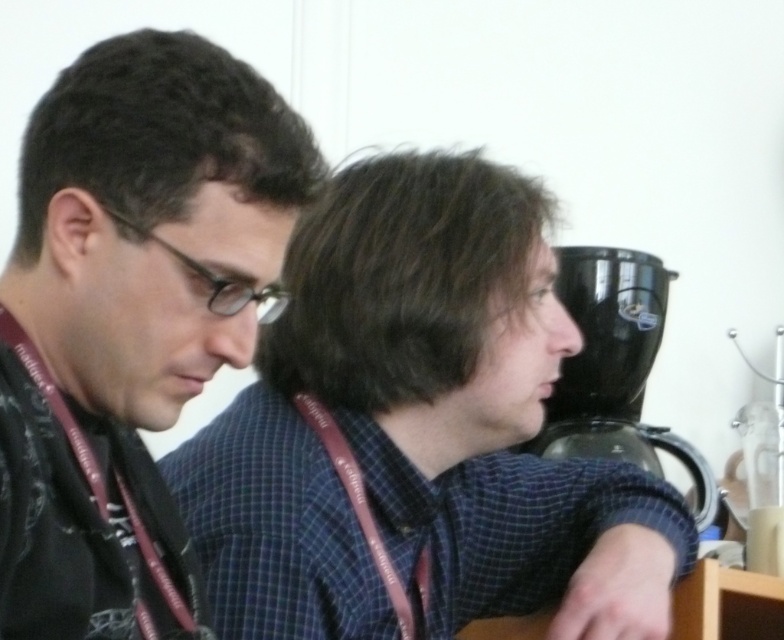
Question: Which point is closer to the camera?

Choices:
 (A) (619, 308)
 (B) (80, 541)

Answer: (B)

Question: Which point appears farthest from the camera in this image?

Choices:
 (A) (60, 250)
 (B) (610, 556)
 (C) (588, 337)

Answer: (C)

Question: Which object is positioned closest to the blue checkered shirt at center?

Choices:
 (A) matte black shirt at left
 (B) black plastic coffee machine at right

Answer: (A)

Question: Does matte black shirt at left have a smaller size compared to black plastic coffee machine at right?

Choices:
 (A) no
 (B) yes

Answer: (B)

Question: Does blue checkered shirt at center appear over black plastic coffee machine at right?

Choices:
 (A) no
 (B) yes

Answer: (A)

Question: Is matte black shirt at left to the right of black plastic coffee machine at right from the viewer's perspective?

Choices:
 (A) yes
 (B) no

Answer: (B)